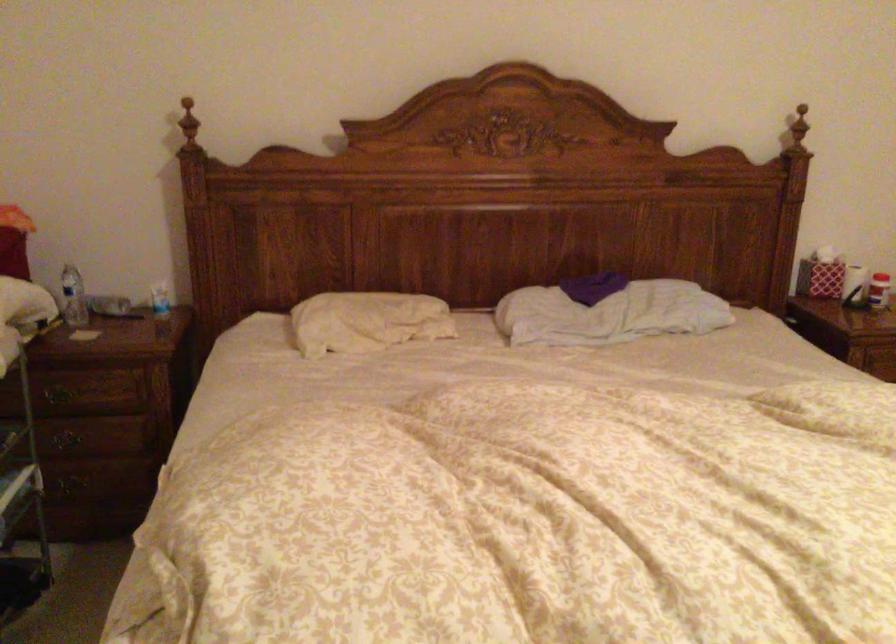
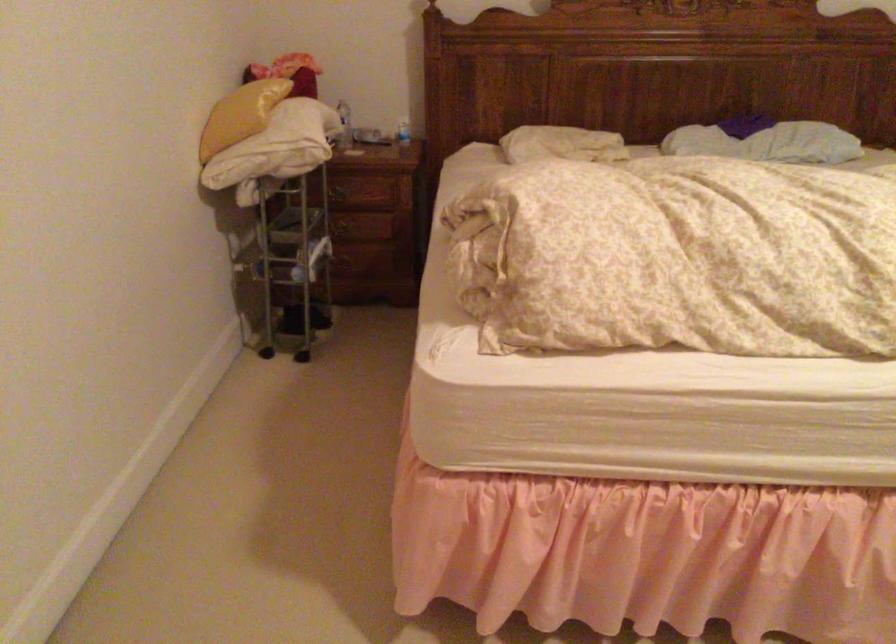
Find the pixel in the second image that matches pixel 609 327 in the first image.

(767, 142)